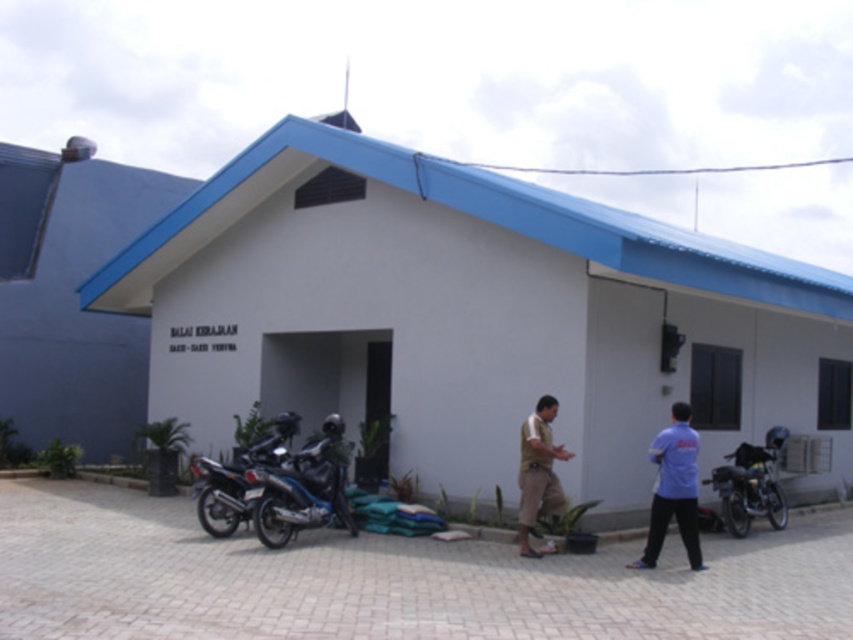
Is blue cotton shirt at center behind brown cotton shirt at center?

That is False.

Between blue cotton shirt at center and brown cotton shirt at center, which one has more height?

brown cotton shirt at center is taller.

Is point (677, 524) closer to viewer compared to point (519, 497)?

Yes, it is.

Where is `blue cotton shirt at center`? blue cotton shirt at center is located at coordinates pyautogui.click(x=672, y=488).

What do you see at coordinates (750, 484) in the screenshot? I see `metallic silver motorcycle at center` at bounding box center [750, 484].

How much distance is there between metallic silver motorcycle at center and brown cotton shirt at center?

metallic silver motorcycle at center is 3.30 meters from brown cotton shirt at center.

This screenshot has width=853, height=640. Find the location of `metallic silver motorcycle at center`. metallic silver motorcycle at center is located at coordinates (750, 484).

The width and height of the screenshot is (853, 640). What do you see at coordinates (672, 488) in the screenshot? I see `blue cotton shirt at center` at bounding box center [672, 488].

Is point (660, 483) in front of point (773, 452)?

Yes.

Where is `blue cotton shirt at center`? Image resolution: width=853 pixels, height=640 pixels. blue cotton shirt at center is located at coordinates (672, 488).